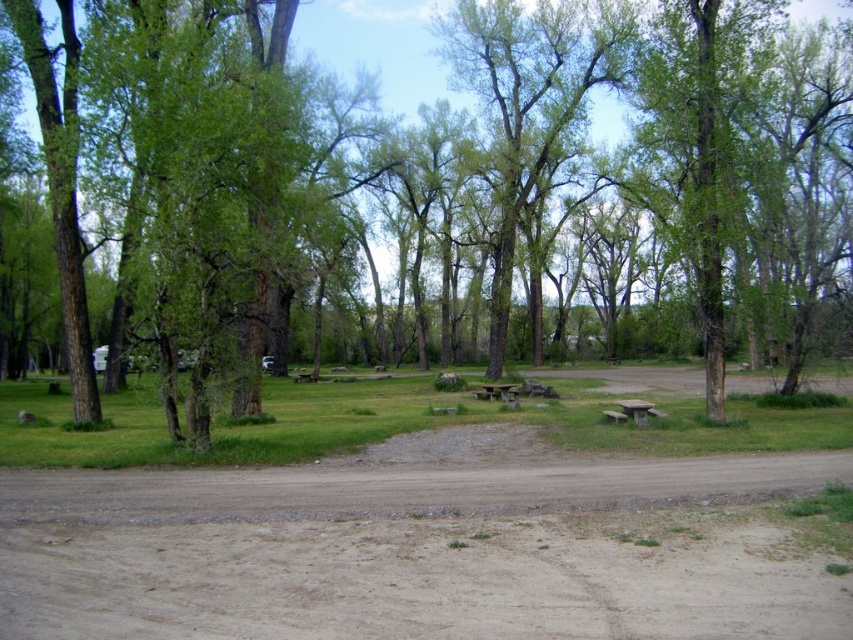
You are planning to set up a small tent in the brown sandy dirt field at center. Considering the size of the wooden picnic table at center, will there be enough space to place the tent without overlapping the picnic table?

The brown sandy dirt field at center is bigger than the wooden picnic table at center, so there should be enough space to place the tent without overlapping the picnic table.

You are planning to set up a tent in the park. The tent requires a space wider than the stone textured picnic table at center. Is the green leafy tree at center wide enough to accommodate the tent? Please explain your reasoning based on the scene description.

The green leafy tree at center has a width larger than the stone textured picnic table at center. Since the tent requires a space wider than the picnic table, the area under the green leafy tree at center should be sufficient to accommodate the tent.

Looking at this image, you are standing at the entrance of the park and want to reach the picnic area. According to the image, where is the brown sandy dirt field at center located?

The brown sandy dirt field at center is located at point [418,547].